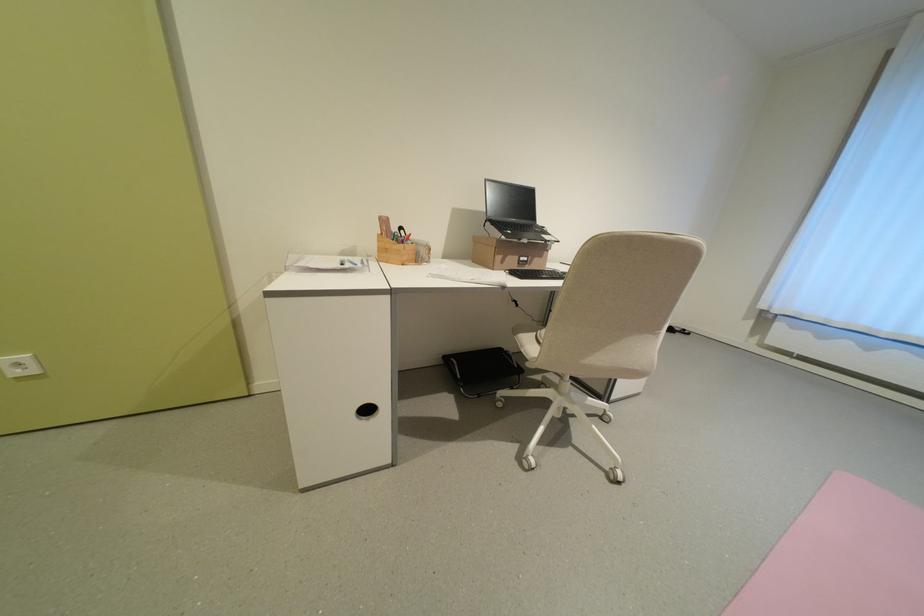
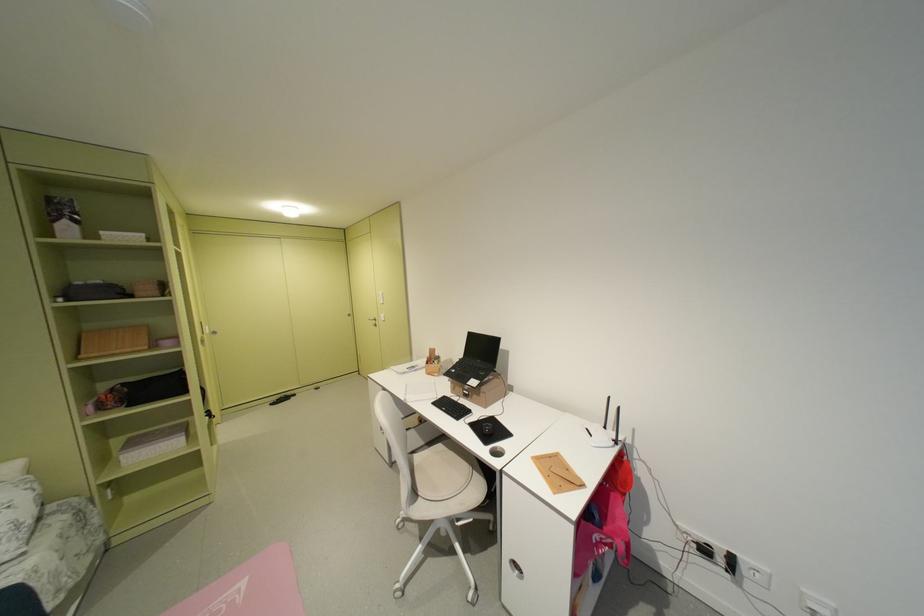
Find the pixel in the second image that matches (x=541, y=272) in the first image.

(464, 403)